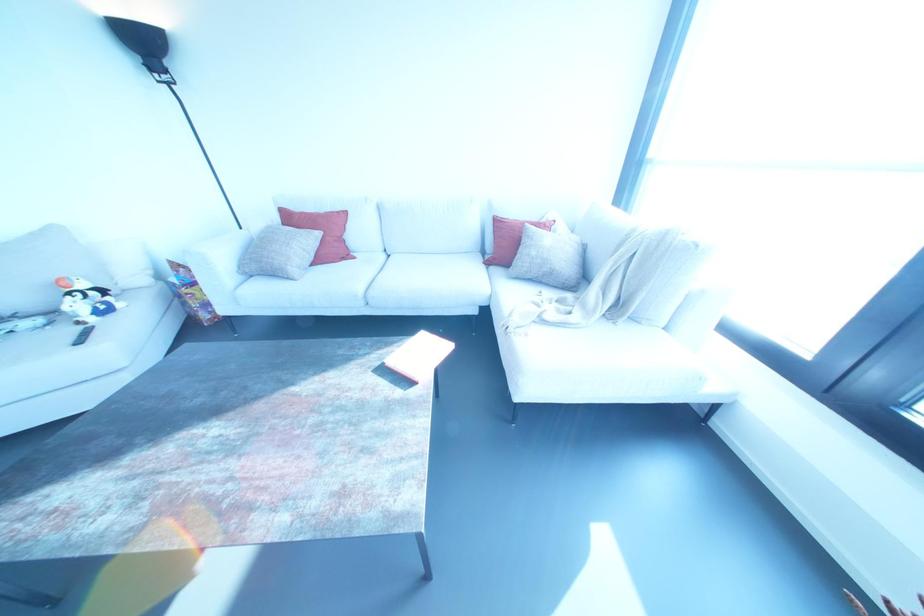
What do you see at coordinates (662, 286) in the screenshot?
I see `the beige blanket` at bounding box center [662, 286].